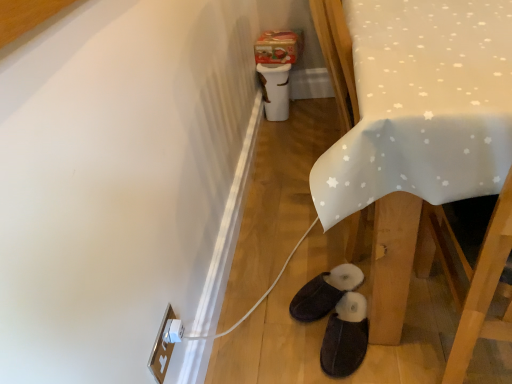
Question: Is black suede slippers at lower center, arranged as the second footwear when viewed from the front, wider or thinner than white plastic electric outlet at lower left?

Choices:
 (A) thin
 (B) wide

Answer: (B)

Question: Is point (332, 286) closer or farther from the camera than point (168, 345)?

Choices:
 (A) closer
 (B) farther

Answer: (B)

Question: Based on their relative distances, which object is nearer to the dark brown suede slippers at lower center, the 1th footwear in the front-to-back sequence?

Choices:
 (A) white fabric table at lower right
 (B) white plastic electric outlet at lower left
 (C) black suede slippers at lower center, which is counted as the 1th footwear, starting from the back

Answer: (C)

Question: Which object is the closest to the dark brown suede slippers at lower center, the 1th footwear in the front-to-back sequence?

Choices:
 (A) white fabric table at lower right
 (B) black suede slippers at lower center, which is counted as the 1th footwear, starting from the back
 (C) white plastic electric outlet at lower left

Answer: (B)